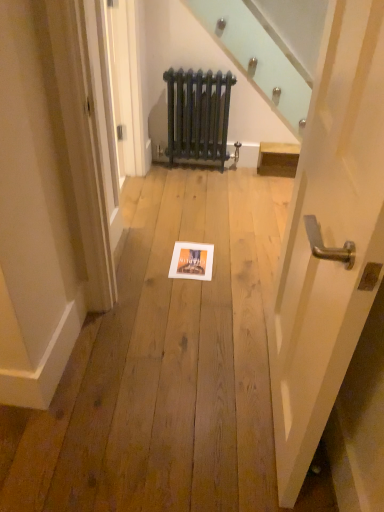
The image size is (384, 512). In order to click on free location in front of dark blue cast iron radiator at center in this screenshot , I will do click(197, 182).